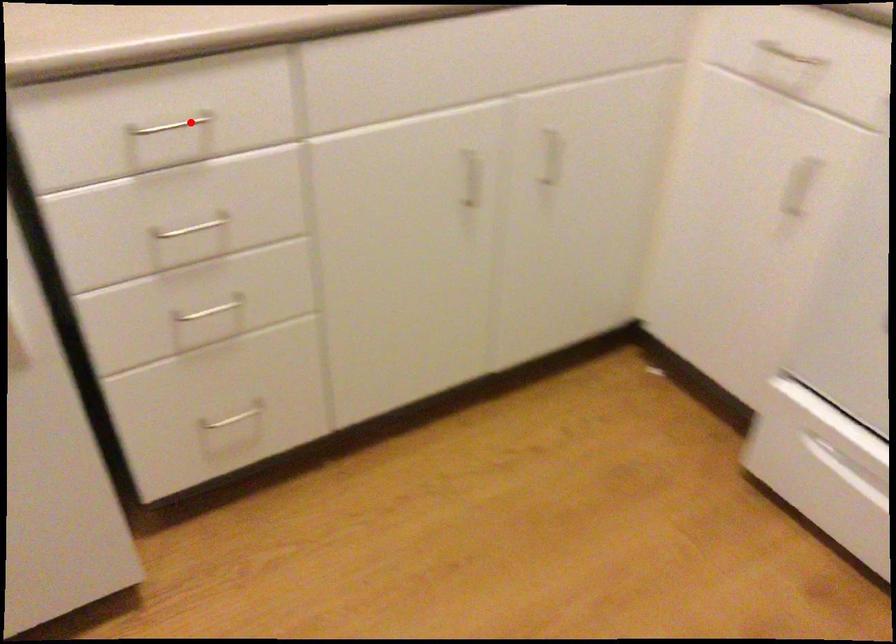
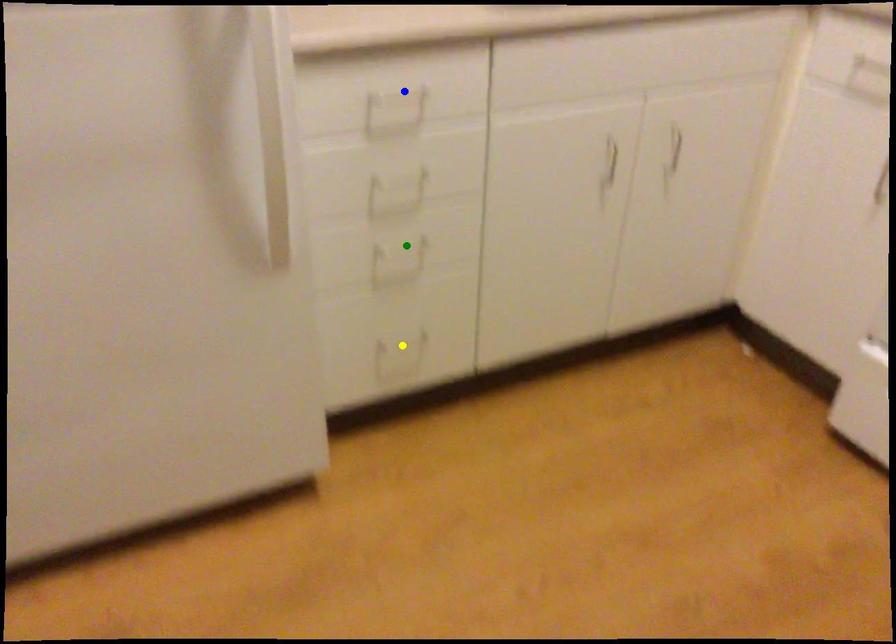
Question: I am providing you with two images of the same scene from different viewpoints. A red point is marked on the first image. You are given multiple points on the second image. In image 2, which mark is for the same physical point as the one in image 1?

Choices:
 (A) green point
 (B) blue point
 (C) yellow point

Answer: (B)